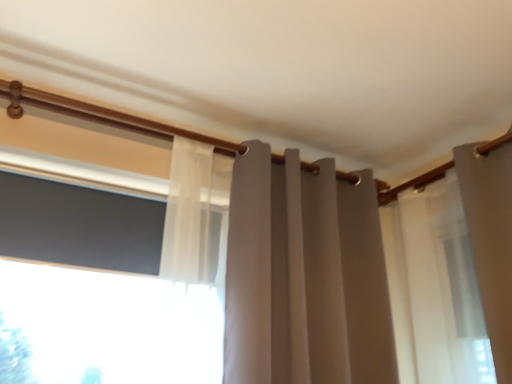
Question: From their relative heights in the image, would you say matte gray curtain at center is taller or shorter than black matte window screen at left?

Choices:
 (A) tall
 (B) short

Answer: (A)

Question: From the image's perspective, relative to black matte window screen at left, is matte gray curtain at center above or below?

Choices:
 (A) below
 (B) above

Answer: (A)

Question: In terms of size, does matte gray curtain at center appear bigger or smaller than black matte window screen at left?

Choices:
 (A) small
 (B) big

Answer: (B)

Question: Does point (142, 241) appear closer or farther from the camera than point (434, 273)?

Choices:
 (A) farther
 (B) closer

Answer: (B)

Question: From their relative heights in the image, would you say black matte window screen at left is taller or shorter than matte gray curtain at center?

Choices:
 (A) short
 (B) tall

Answer: (A)

Question: From a real-world perspective, is black matte window screen at left physically located above or below matte gray curtain at center?

Choices:
 (A) above
 (B) below

Answer: (A)

Question: Considering the relative positions of black matte window screen at left and matte gray curtain at center in the image provided, is black matte window screen at left to the left or to the right of matte gray curtain at center?

Choices:
 (A) left
 (B) right

Answer: (A)